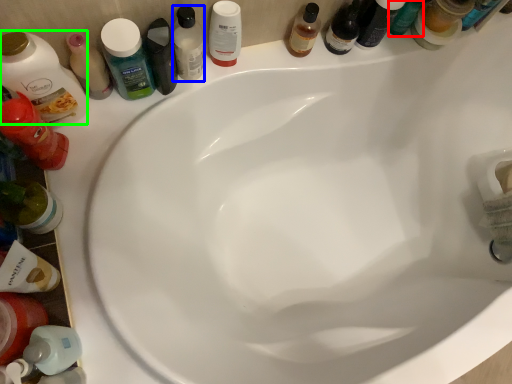
Question: Which is nearer to the bottle (highlighted by a red box)? mouthwash (highlighted by a blue box) or toiletry (highlighted by a green box).

Choices:
 (A) mouthwash
 (B) toiletry

Answer: (A)